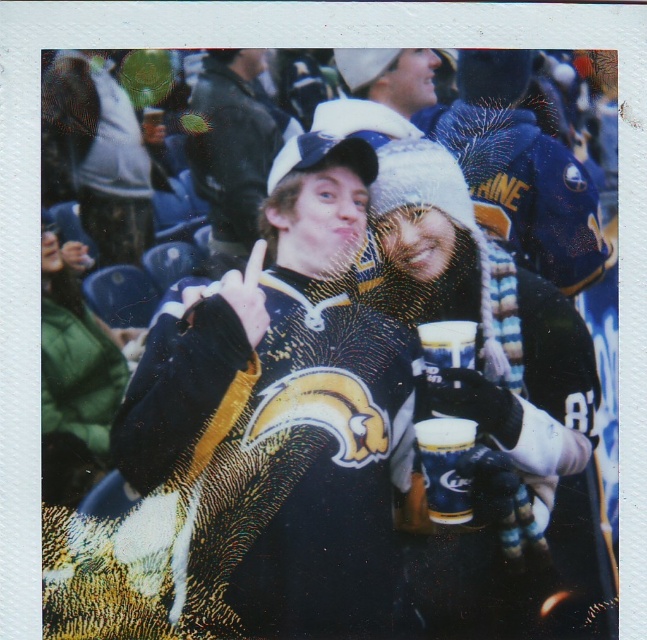
Between matte black jacket at center and gold metallic cup at center, which one is positioned higher?

matte black jacket at center is above.

This screenshot has width=647, height=640. I want to click on matte black jacket at center, so [232, 148].

Is point (206, 84) in front of point (433, 445)?

That is False.

Where is `matte black jacket at center`? This screenshot has width=647, height=640. matte black jacket at center is located at coordinates (232, 148).